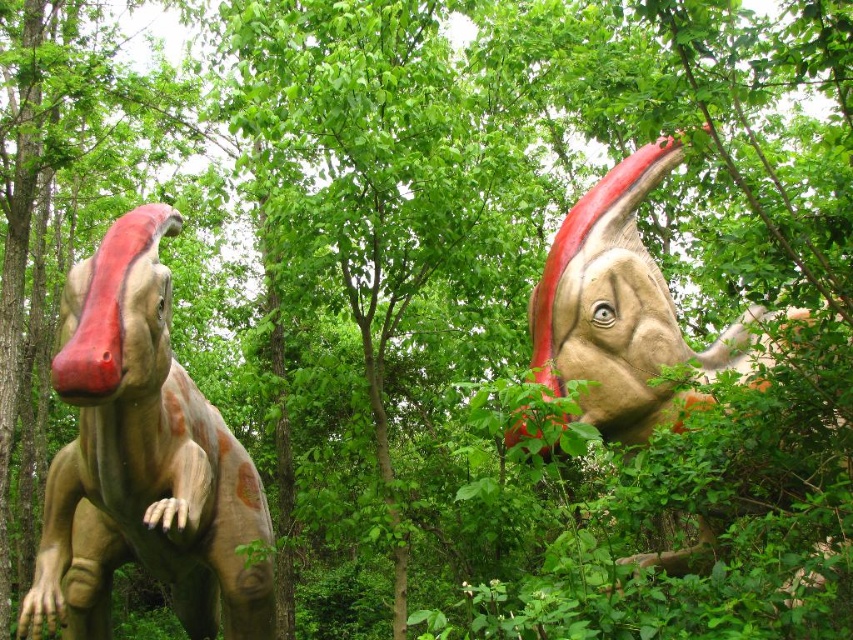
Question: Observing the image, what is the correct spatial positioning of matte brown dinosaur at left in reference to matte orange dinosaur at upper right?

Choices:
 (A) left
 (B) right

Answer: (A)

Question: Is matte brown dinosaur at left below matte orange dinosaur at upper right?

Choices:
 (A) yes
 (B) no

Answer: (A)

Question: Which object is farther from the camera taking this photo?

Choices:
 (A) matte brown dinosaur at left
 (B) matte orange dinosaur at upper right

Answer: (A)

Question: Is matte brown dinosaur at left bigger than matte orange dinosaur at upper right?

Choices:
 (A) yes
 (B) no

Answer: (B)